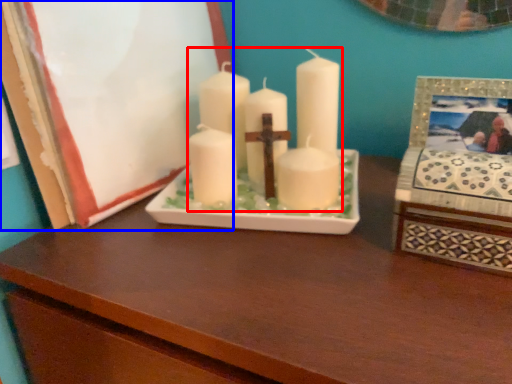
Question: Which object is further to the camera taking this photo, candle (highlighted by a red box) or picture frame (highlighted by a blue box)?

Choices:
 (A) candle
 (B) picture frame

Answer: (A)